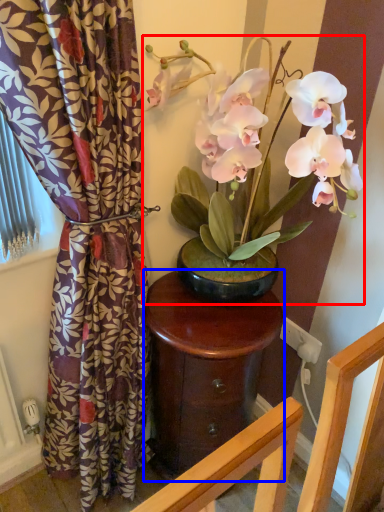
Question: Which object appears closest to the camera in this image, houseplant (highlighted by a red box) or table (highlighted by a blue box)?

Choices:
 (A) houseplant
 (B) table

Answer: (A)